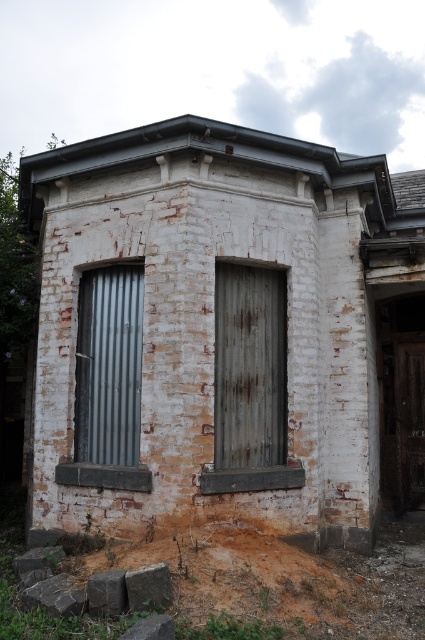
You are a maintenance worker inspecting the brick structure. You notice a point at coordinates (249, 365). What object is located at that point?

The point at coordinates (249, 365) indicates a rusty metal door at center.

You are standing in front of the brick structure and notice two points marked on the wall. The first point is at coordinates point (261,371) and the second is at point (411,484). From your perspective, which point appears closer to you?

Point (261,371) is in front of point (411,484), so it appears closer to you.

Looking at this image, you are standing in front of the weathered brick structure and want to enter through the metallic corrugated door at left. What are the coordinates of the door?

The metallic corrugated door at left is located at coordinates point (108, 365).